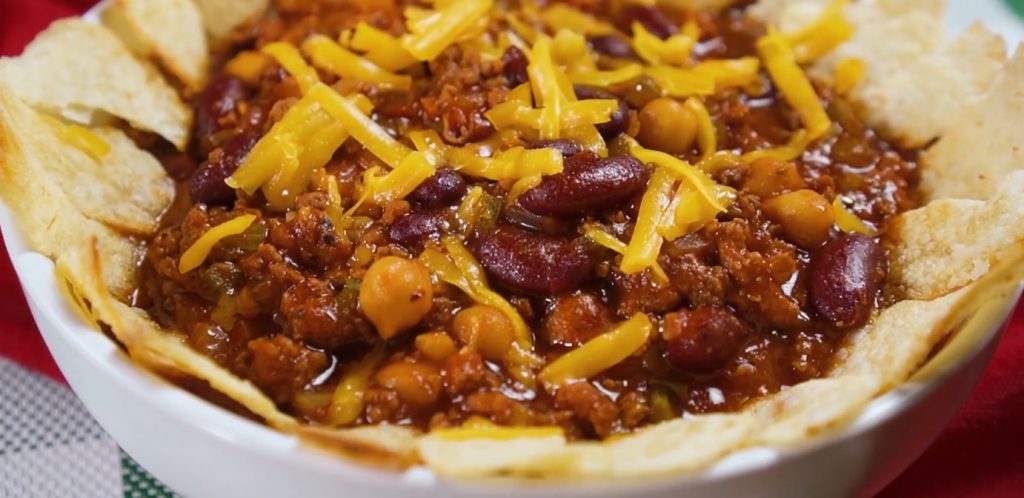
At what (x,y) coordinates should I click in order to perform the action: click on white bowl. Please return your answer as a coordinate pair (x, y). The image size is (1024, 498). Looking at the image, I should click on (317, 485).